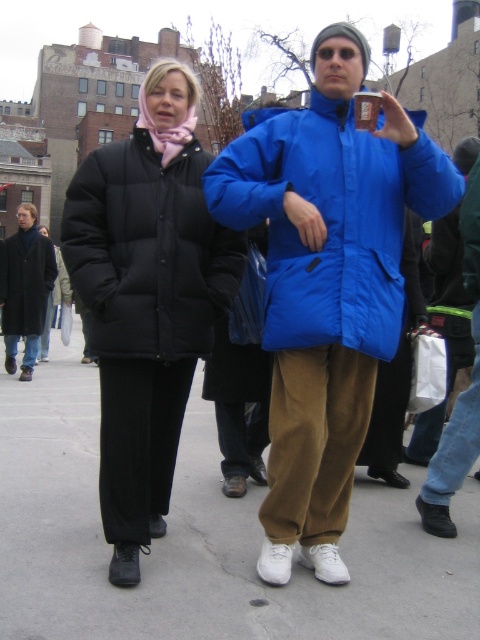
Who is taller, blue puffy jacket at center or blue synthetic jacket at center?

Standing taller between the two is blue puffy jacket at center.

Who is positioned more to the right, blue puffy jacket at center or blue synthetic jacket at center?

blue synthetic jacket at center is more to the right.

This screenshot has width=480, height=640. What are the coordinates of `blue puffy jacket at center` in the screenshot? It's located at (331, 218).

Locate an element on the screen. blue puffy jacket at center is located at coordinates point(331,218).

Is point (0, 531) in front of point (154, 92)?

Yes, it is.

Is white concrete pavement at center above black puffy coat at left?

No.

Where is `white concrete pavement at center`? Image resolution: width=480 pixels, height=640 pixels. white concrete pavement at center is located at coordinates (202, 538).

Where is `white concrete pavement at center`? This screenshot has width=480, height=640. white concrete pavement at center is located at coordinates (202, 538).

In the scene shown: Can you confirm if blue puffy jacket at center is smaller than black puffy jacket at left?

No.

Is blue puffy jacket at center below black puffy jacket at left?

No.

Between point (364, 198) and point (168, 310), which one is positioned behind?

Positioned behind is point (168, 310).

Image resolution: width=480 pixels, height=640 pixels. I want to click on blue puffy jacket at center, so click(331, 218).